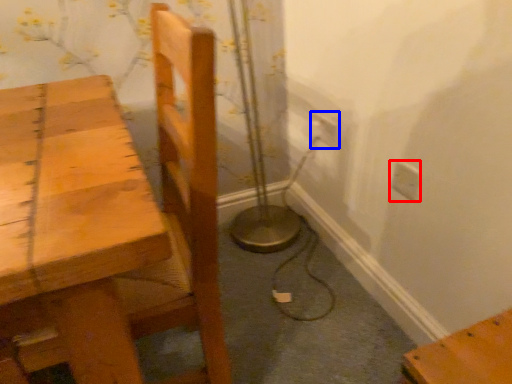
Question: Which object appears farthest to the camera in this image, electric outlet (highlighted by a red box) or electric outlet (highlighted by a blue box)?

Choices:
 (A) electric outlet
 (B) electric outlet

Answer: (B)